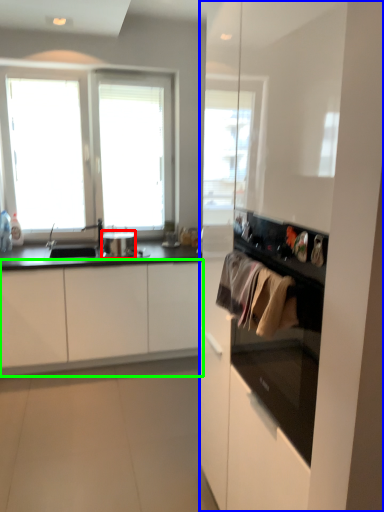
Question: Based on their relative distances, which object is nearer to appliance (highlighted by a red box)? Choose from dresser (highlighted by a blue box) and cabinetry (highlighted by a green box).

Choices:
 (A) dresser
 (B) cabinetry

Answer: (B)